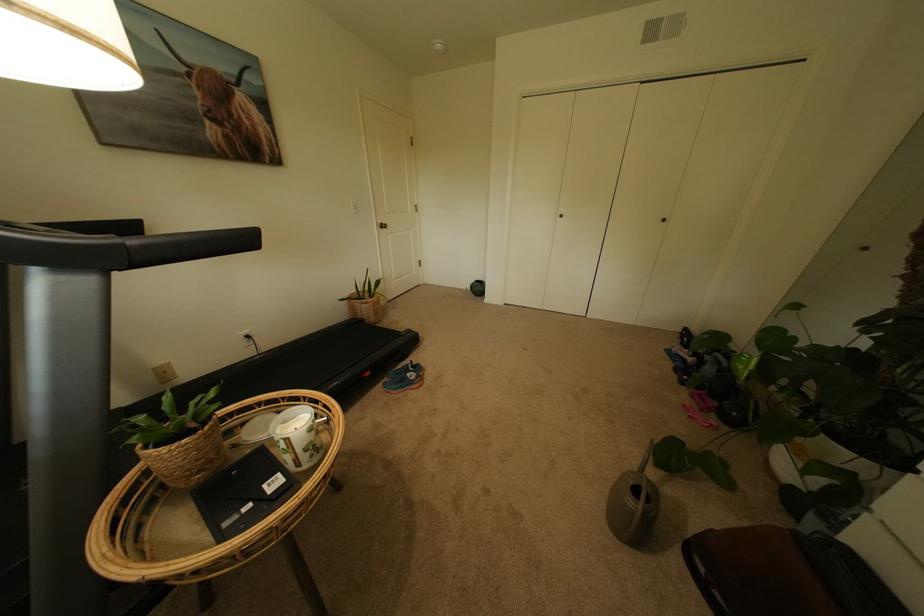
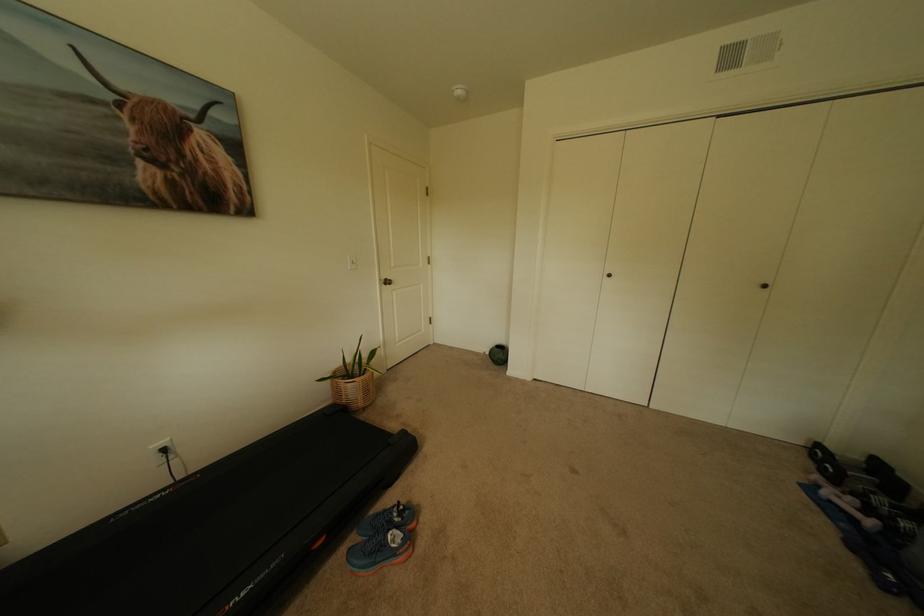
Find the pixel in the second image that matches point (694, 362) in the first image.

(862, 521)